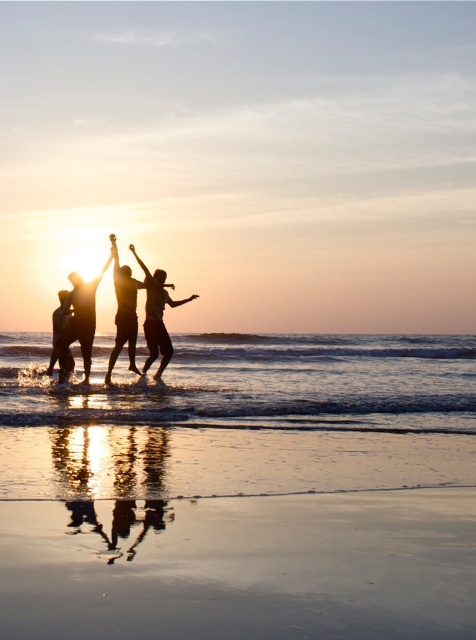
Is point (244, 563) more distant than point (86, 332)?

No.

Identify the location of shiny sand beach at lower center. The image size is (476, 640). (237, 534).

Image resolution: width=476 pixels, height=640 pixels. In order to click on shiny sand beach at lower center in this screenshot , I will do `click(237, 534)`.

The height and width of the screenshot is (640, 476). Identify the location of shiny sand beach at lower center. (237, 534).

Is shiny sand beach at lower center taller than silhouette figure at lower left?

Incorrect, shiny sand beach at lower center's height is not larger of silhouette figure at lower left's.

Which is more to the left, shiny sand beach at lower center or silhouette figure at lower left?

From the viewer's perspective, silhouette figure at lower left appears more on the left side.

The image size is (476, 640). What do you see at coordinates (237, 534) in the screenshot?
I see `shiny sand beach at lower center` at bounding box center [237, 534].

You are a GUI agent. You are given a task and a screenshot of the screen. Output one action in this format:
    pyautogui.click(x=<x>, y=<y>)
    Task: Click on the shiny sand beach at lower center
    Image resolution: width=476 pixels, height=640 pixels.
    Given the screenshot: What is the action you would take?
    pyautogui.click(x=237, y=534)

Is shiny sand beach at lower center bigger than black matte people at center?

No.

Where is `shiny sand beach at lower center`? shiny sand beach at lower center is located at coordinates (237, 534).